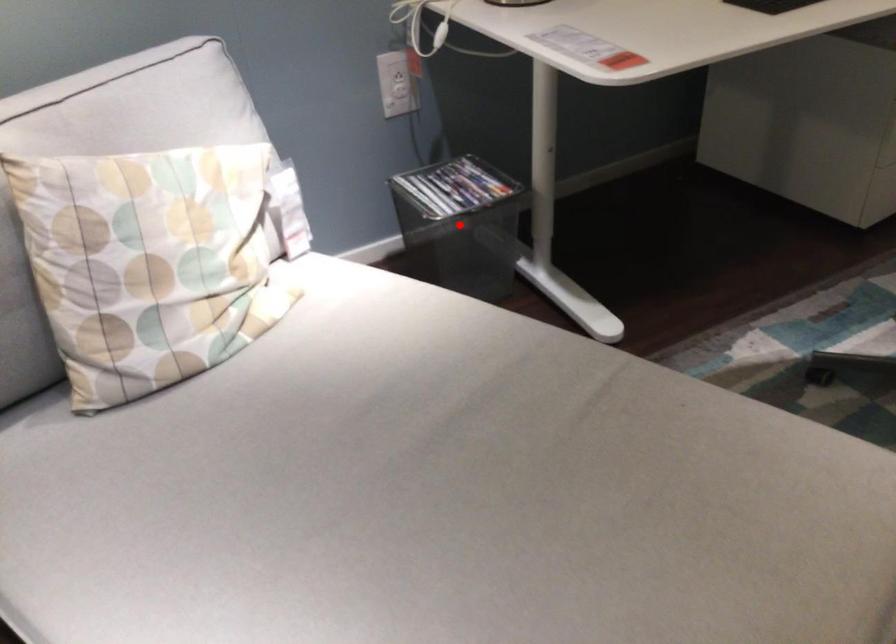
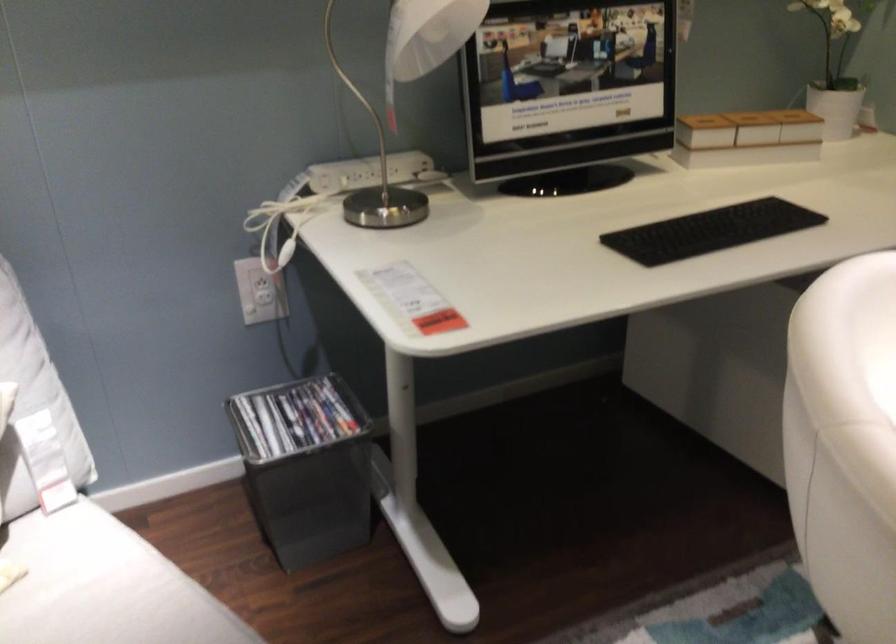
Locate, in the second image, the point that corresponds to the highlighted location in the first image.

(355, 437)